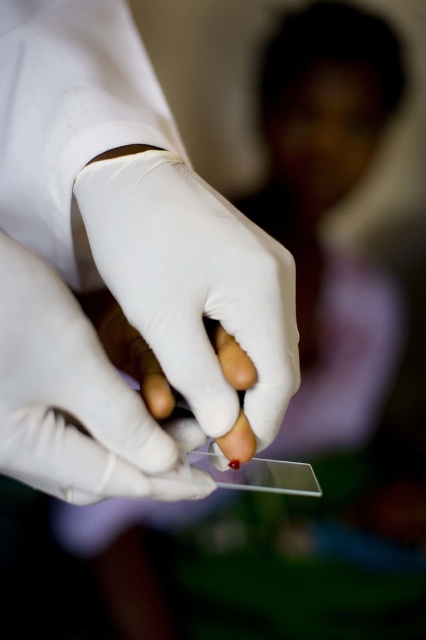
Can you confirm if transparent glass slide at center is bigger than white smooth glove at center?

Correct, transparent glass slide at center is larger in size than white smooth glove at center.

Describe the element at coordinates (118, 266) in the screenshot. I see `transparent glass slide at center` at that location.

Measure the distance between transparent glass slide at center and camera.

11.55 inches

This screenshot has width=426, height=640. Find the location of `transparent glass slide at center`. transparent glass slide at center is located at coordinates [118, 266].

Is point (62, 410) farther from viewer compared to point (124, 349)?

No, it is not.

Can you confirm if white matte gloves at center is taller than white matte glove at center?

Indeed, white matte gloves at center has a greater height compared to white matte glove at center.

Which is in front, point (62, 451) or point (170, 410)?

Positioned in front is point (62, 451).

Where is `white matte gloves at center`? The height and width of the screenshot is (640, 426). white matte gloves at center is located at coordinates (75, 401).

Measure the distance from transparent glass slide at center to white matte glove at center.

transparent glass slide at center is 8.38 centimeters away from white matte glove at center.

Can you confirm if transparent glass slide at center is positioned above white matte glove at center?

Indeed, transparent glass slide at center is positioned over white matte glove at center.

The image size is (426, 640). In order to click on transparent glass slide at center in this screenshot , I will do `click(118, 266)`.